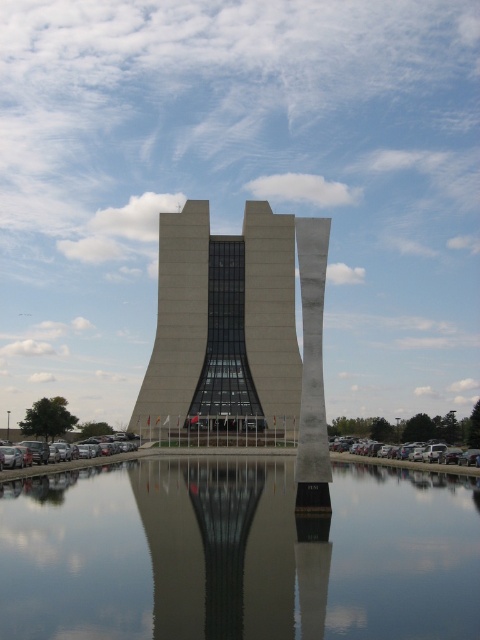
You are standing at the point closest to the water feature. Which of the two points, point (252, 390) or point (6, 445), is farther away from you?

Point (252, 390) is farther away from you because it is behind point (6, 445).

You are a photographer planning to capture the reflection of the building in the clear glass water at center. However, there is a silver metallic car at lower left parked nearby. Will the car block the reflection of the building in the water?

The clear glass water at center is wider than the silver metallic car at lower left, so the car will not block the reflection of the building in the water.